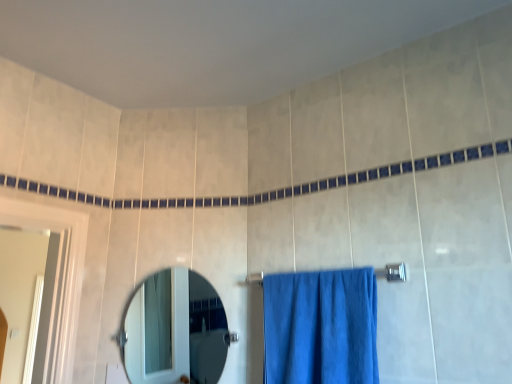
Question: Based on their sizes in the image, would you say silver metallic towel bar at center is bigger or smaller than clear glass mirror at center?

Choices:
 (A) big
 (B) small

Answer: (B)

Question: From the image's perspective, relative to clear glass mirror at center, is silver metallic towel bar at center above or below?

Choices:
 (A) below
 (B) above

Answer: (B)

Question: Which is farther from the silver metallic towel bar at center?

Choices:
 (A) clear glass mirror at center
 (B) blue fabric towel at center

Answer: (A)

Question: Which of these objects is positioned closest to the silver metallic towel bar at center?

Choices:
 (A) clear glass mirror at center
 (B) blue fabric towel at center

Answer: (B)